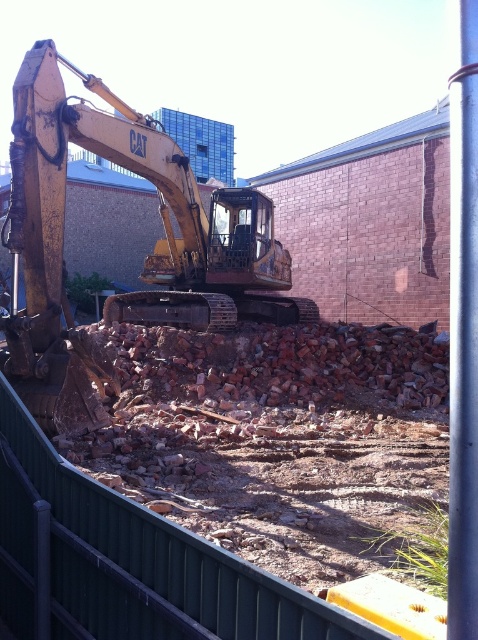
Question: Does yellow metallic excavator at left have a greater width compared to metallic silver pole at right?

Choices:
 (A) no
 (B) yes

Answer: (B)

Question: Can you confirm if yellow metallic excavator at left is thinner than metallic silver pole at right?

Choices:
 (A) yes
 (B) no

Answer: (B)

Question: Which point appears farthest from the camera in this image?

Choices:
 (A) (152, 132)
 (B) (476, 316)

Answer: (A)

Question: Does yellow metallic excavator at left appear over metallic silver pole at right?

Choices:
 (A) yes
 (B) no

Answer: (A)

Question: Which point is farther to the camera?

Choices:
 (A) yellow metallic excavator at left
 (B) metallic silver pole at right

Answer: (A)